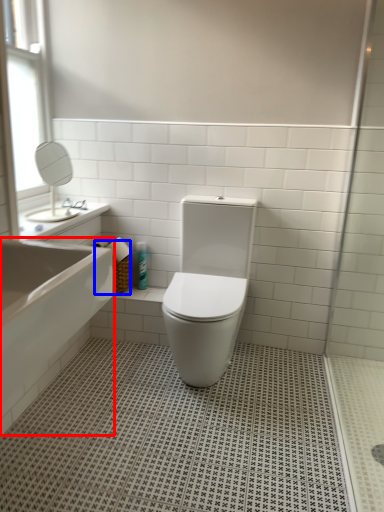
Question: Which point is closer to the camera, bath (highlighted by a red box) or basket (highlighted by a blue box)?

Choices:
 (A) bath
 (B) basket

Answer: (A)